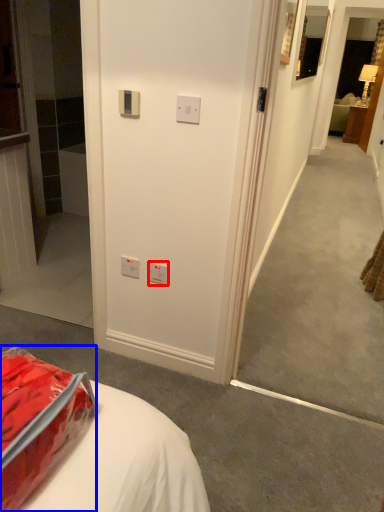
Question: Which object appears farthest to the camera in this image, electric outlet (highlighted by a red box) or package (highlighted by a blue box)?

Choices:
 (A) electric outlet
 (B) package

Answer: (A)